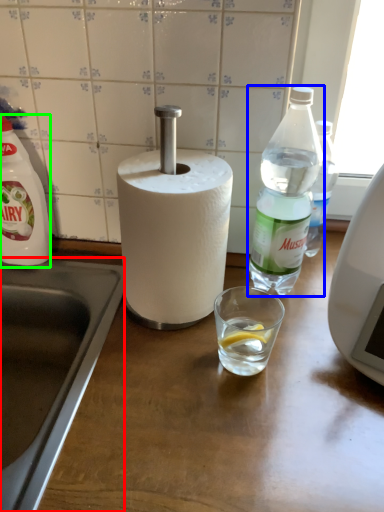
Question: Which object is the farthest from sink (highlighted by a red box)? Choose among these: bottle (highlighted by a blue box) or bottle (highlighted by a green box).

Choices:
 (A) bottle
 (B) bottle

Answer: (A)